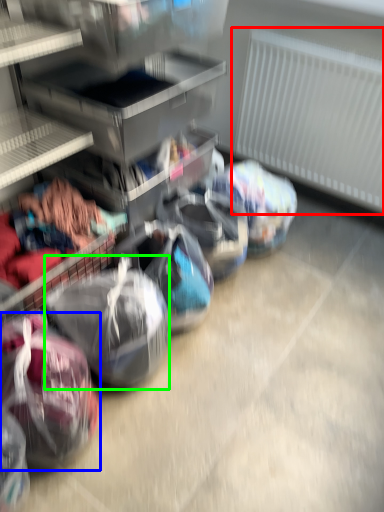
Question: Estimate the real-world distances between objects in this image. Which object is farther from radiator (highlighted by a red box), sack (highlighted by a blue box) or sack (highlighted by a green box)?

Choices:
 (A) sack
 (B) sack

Answer: (A)